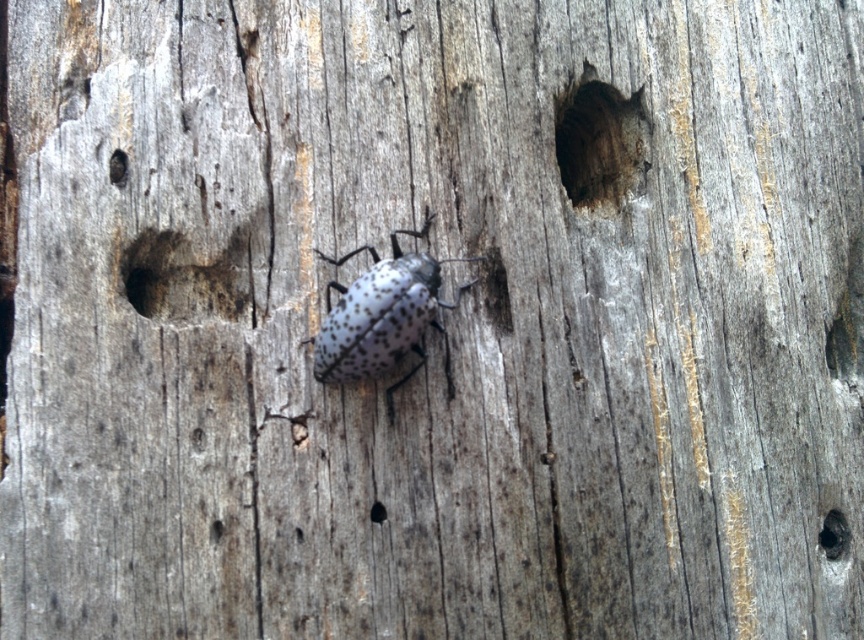
You are an entomologist examining the wood. You notice the speckled matte beetle at center and the dark wood hole at lower right. Which object is directly above the other?

The speckled matte beetle at center is positioned over dark wood hole at lower right, so the beetle is directly above the hole.

You are an entomologist examining the dark wood hole at upper center and the dark wood hole at lower right. Which hole has a larger opening?

The dark wood hole at upper center might be wider than the dark wood hole at lower right according to the description.